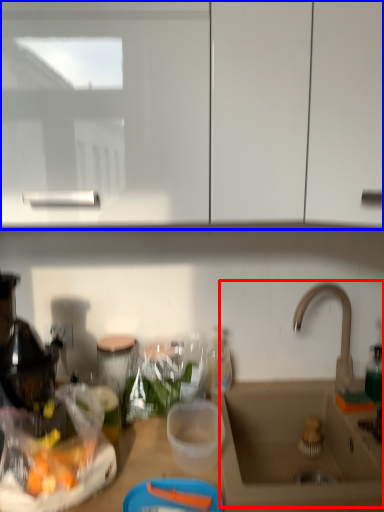
Question: Which point is closer to the camera, sink (highlighted by a red box) or cabinetry (highlighted by a blue box)?

Choices:
 (A) sink
 (B) cabinetry

Answer: (B)